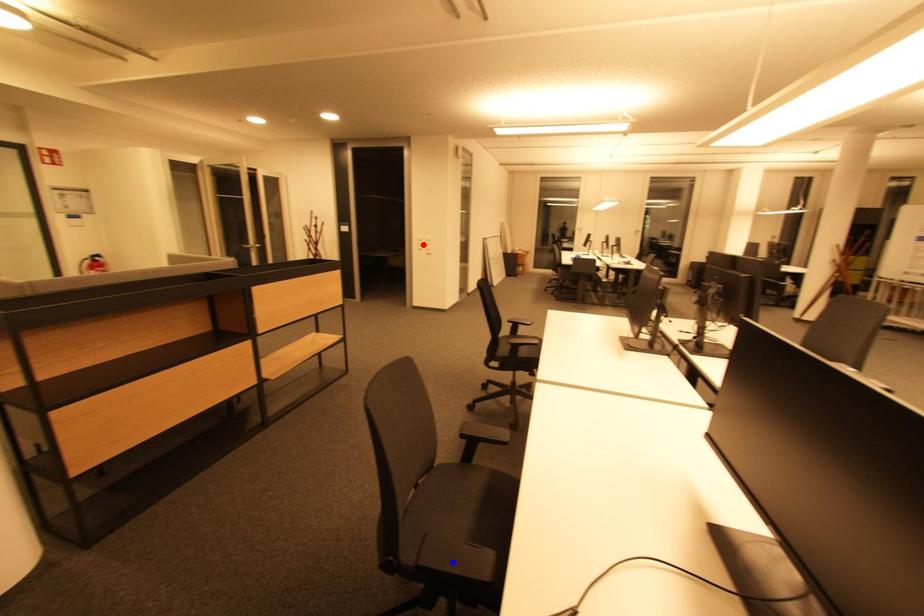
Question: In the image, two points are highlighted. Which point is nearer to the camera? Reply with the corresponding letter.

Choices:
 (A) blue point
 (B) red point

Answer: (A)